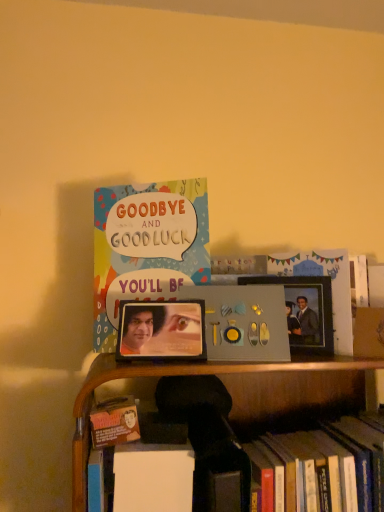
Question: Is multicolored paper card at upper center, which is counted as the 2th book, starting from the right, thinner than metallic photo frame at center, which is the second picture frame in right-to-left order?

Choices:
 (A) yes
 (B) no

Answer: (A)

Question: Considering the relative sizes of multicolored paper card at upper center, acting as the second book starting from the bottom, and metallic photo frame at center, marked as the first picture frame in a left-to-right arrangement, in the image provided, is multicolored paper card at upper center, acting as the second book starting from the bottom, bigger than metallic photo frame at center, marked as the first picture frame in a left-to-right arrangement,?

Choices:
 (A) no
 (B) yes

Answer: (B)

Question: Is multicolored paper card at upper center, positioned as the 1th book in top-to-bottom order, positioned before metallic photo frame at center, marked as the first picture frame in a left-to-right arrangement?

Choices:
 (A) no
 (B) yes

Answer: (A)

Question: Is the depth of multicolored paper card at upper center, acting as the second book starting from the bottom, greater than that of metallic photo frame at center, the 2th picture frame in the back-to-front sequence?

Choices:
 (A) yes
 (B) no

Answer: (A)

Question: Can you confirm if multicolored paper card at upper center, acting as the second book starting from the bottom, is positioned to the right of metallic photo frame at center, the 2th picture frame in the back-to-front sequence?

Choices:
 (A) yes
 (B) no

Answer: (B)

Question: From the image's perspective, is multicolored paper card at upper center, which is counted as the 2th book, starting from the right, below metallic photo frame at center, marked as the first picture frame in a left-to-right arrangement?

Choices:
 (A) yes
 (B) no

Answer: (B)

Question: Does metallic silver photo frame at right, positioned as the 1th picture frame in back-to-front order, appear on the right side of metallic photo frame at center, which is the second picture frame in right-to-left order?

Choices:
 (A) no
 (B) yes

Answer: (B)

Question: Considering the relative positions of metallic silver photo frame at right, which is the second picture frame in front-to-back order, and metallic photo frame at center, marked as the first picture frame in a left-to-right arrangement, in the image provided, is metallic silver photo frame at right, which is the second picture frame in front-to-back order, in front of metallic photo frame at center, marked as the first picture frame in a left-to-right arrangement,?

Choices:
 (A) yes
 (B) no

Answer: (B)

Question: Does metallic silver photo frame at right, which is the second picture frame in front-to-back order, have a larger size compared to metallic photo frame at center, the 2th picture frame in the back-to-front sequence?

Choices:
 (A) no
 (B) yes

Answer: (A)

Question: Does metallic silver photo frame at right, positioned as the 1th picture frame in back-to-front order, appear on the left side of metallic photo frame at center, which ranks as the 1th picture frame in front-to-back order?

Choices:
 (A) yes
 (B) no

Answer: (B)

Question: From a real-world perspective, is metallic silver photo frame at right, the first picture frame from the right, under metallic photo frame at center, which is the second picture frame in right-to-left order?

Choices:
 (A) yes
 (B) no

Answer: (B)

Question: Is metallic silver photo frame at right, which is the second picture frame in front-to-back order, beside metallic photo frame at center, marked as the first picture frame in a left-to-right arrangement?

Choices:
 (A) no
 (B) yes

Answer: (A)

Question: Is hardcover book at lower right, which is the 1th book from right to left, shorter than metallic photo frame at center, marked as the first picture frame in a left-to-right arrangement?

Choices:
 (A) no
 (B) yes

Answer: (A)